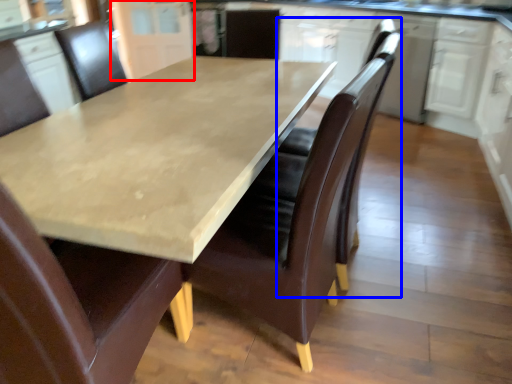
Question: Among these objects, which one is nearest to the camera, cabinetry (highlighted by a red box) or swivel chair (highlighted by a blue box)?

Choices:
 (A) cabinetry
 (B) swivel chair

Answer: (B)